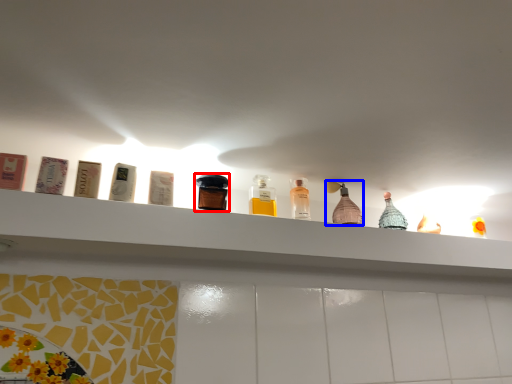
Question: Which point is further to the camera, bottle (highlighted by a red box) or bottle (highlighted by a blue box)?

Choices:
 (A) bottle
 (B) bottle

Answer: (B)